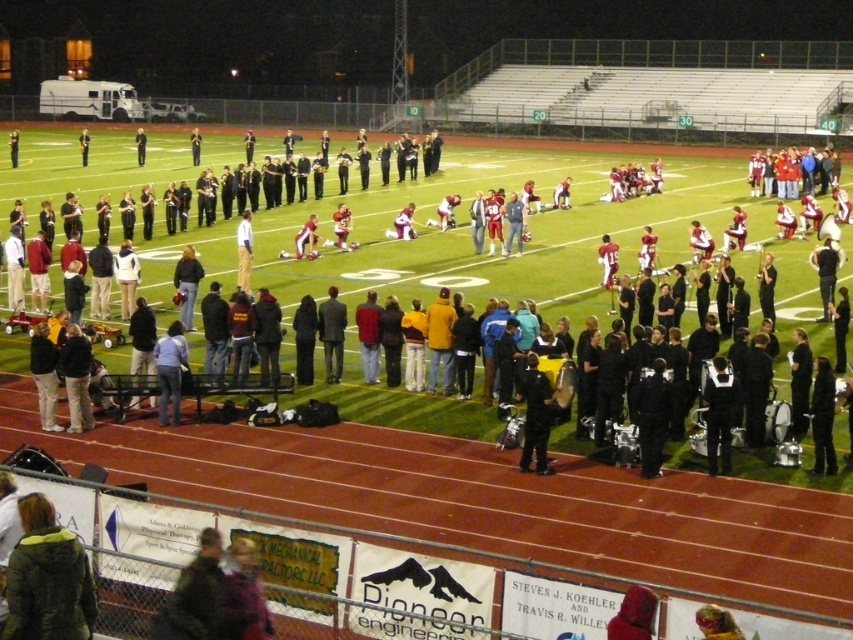
Does black uniform at lower right appear on the left side of light blue shirt at center?

No, black uniform at lower right is not to the left of light blue shirt at center.

From the picture: Which is above, black uniform at lower right or light blue shirt at center?

black uniform at lower right is higher up.

Does point (204, 234) come farther from viewer compared to point (166, 401)?

That is True.

Identify the location of black uniform at lower right. (486, 257).

Locate an element on the screen. black uniform at lower right is located at coordinates (486, 257).

At what (x,y) coordinates should I click in order to perform the action: click on black uniform at lower right. Please return your answer as a coordinate pair (x, y). This screenshot has height=640, width=853. Looking at the image, I should click on (486, 257).

Who is higher up, green fuzzy jacket at lower left or light blue shirt at center?

Positioned higher is light blue shirt at center.

Describe the element at coordinates (47, 579) in the screenshot. I see `green fuzzy jacket at lower left` at that location.

Is point (13, 596) behind point (173, 422)?

That is False.

Find the location of a particular element. This screenshot has height=640, width=853. green fuzzy jacket at lower left is located at coordinates (x=47, y=579).